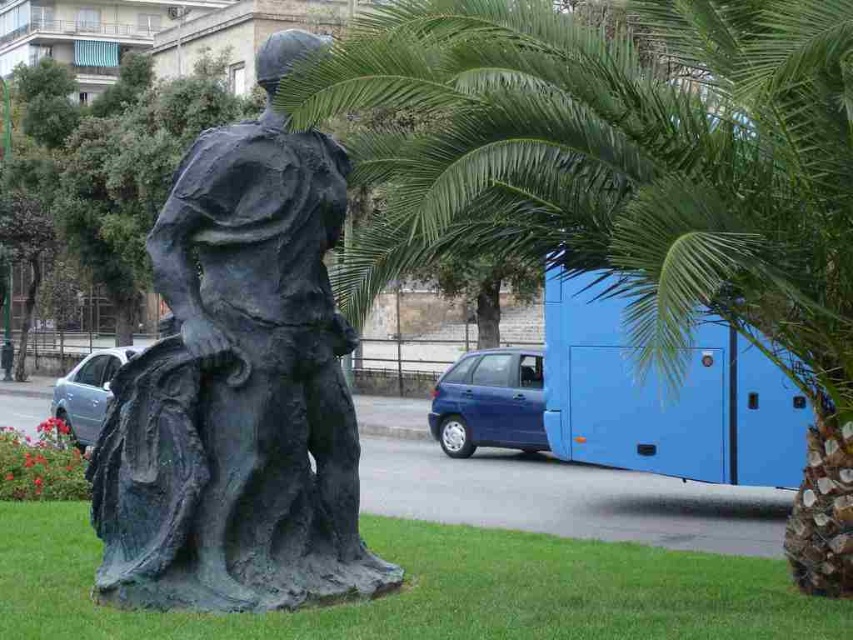
Does green leafy palm tree at upper right come behind bronze statue at center?

Yes.

Image resolution: width=853 pixels, height=640 pixels. Identify the location of green leafy palm tree at upper right. (630, 182).